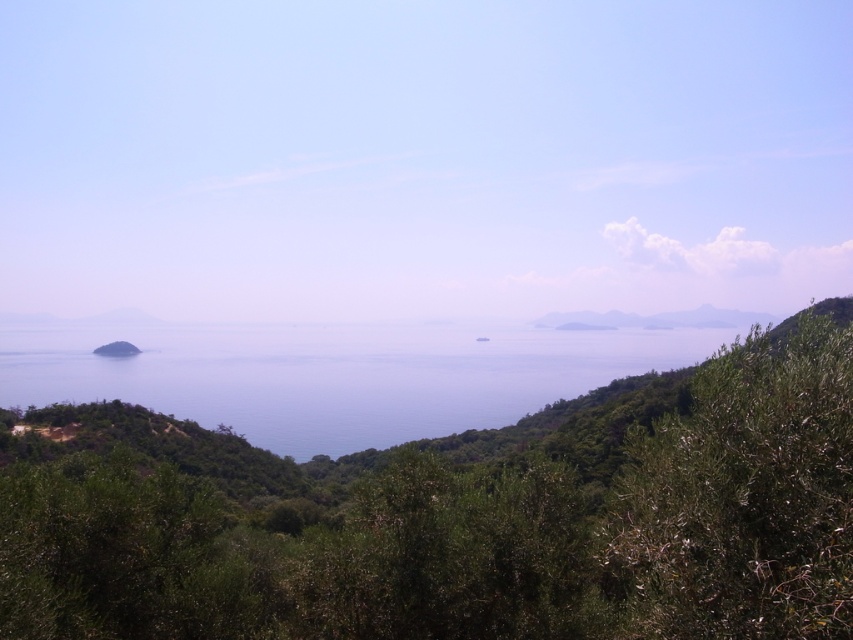
Who is taller, green leafy tree at center or blue water at center?

With more height is green leafy tree at center.

Is point (137, 416) less distant than point (445, 362)?

Yes.

Find the location of a particular element. green leafy tree at center is located at coordinates (456, 515).

Between point (735, 428) and point (701, 316), which one is positioned in front?

Point (735, 428) is more forward.

At what (x,y) coordinates should I click in order to perform the action: click on green leafy tree at center. Please return your answer as a coordinate pair (x, y). Looking at the image, I should click on (456, 515).

Is point (161, 589) behind point (583, 326)?

That is False.

Locate an element on the screen. green leafy tree at center is located at coordinates (456, 515).

Between point (432, 410) and point (120, 348), which one is positioned in front?

Point (432, 410) is more forward.

Which is in front, point (341, 362) or point (115, 348)?

Point (341, 362) is more forward.

In order to click on blue water at center in this screenshot , I will do `click(332, 372)`.